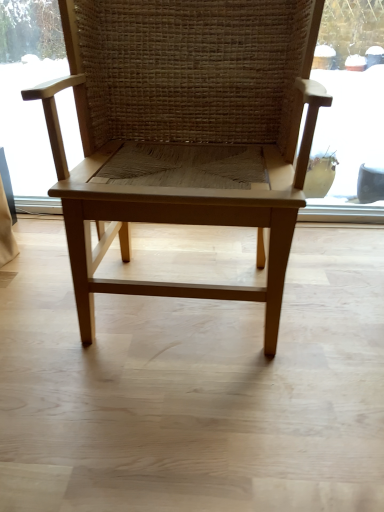
The height and width of the screenshot is (512, 384). I want to click on vacant space that is to the left of light wood chair at center, so click(x=36, y=287).